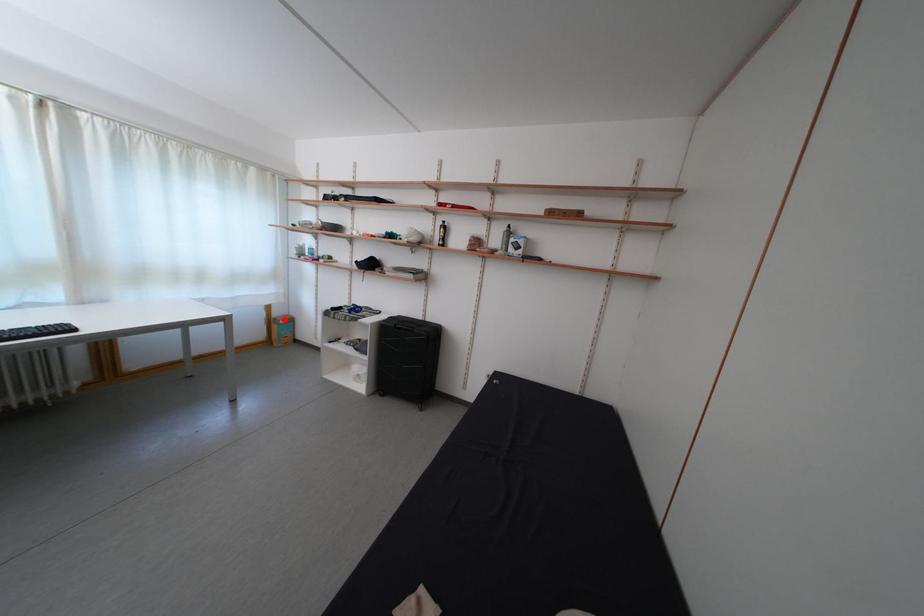
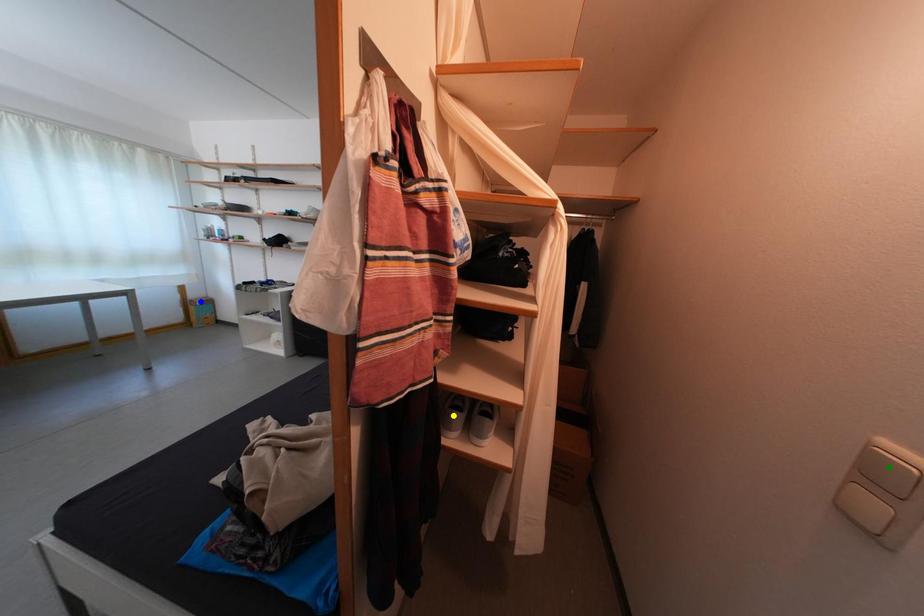
Question: I am providing you with two images of the same scene from different viewpoints. A red point is marked on the first image. You are given multiple points on the second image. Which mark in image 2 goes with the point in image 1?

Choices:
 (A) blue point
 (B) green point
 (C) yellow point

Answer: (A)